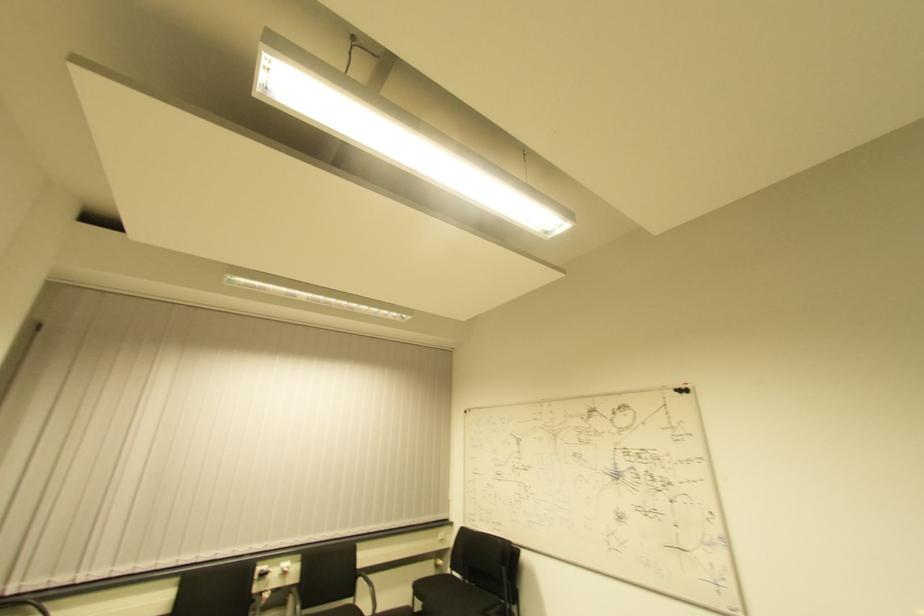
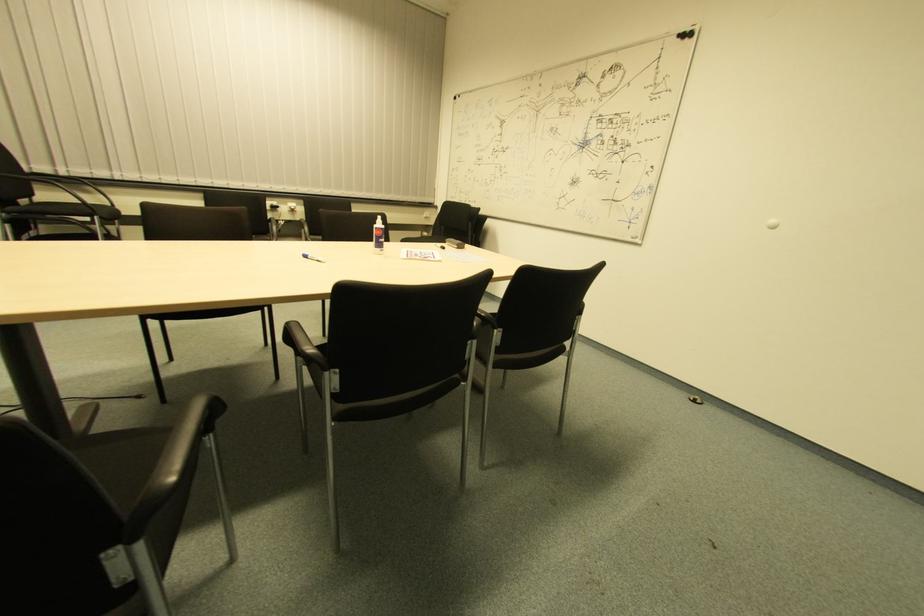
Question: The first image is from the beginning of the video and the second image is from the end. How did the camera likely rotate when shooting the video?

Choices:
 (A) Left
 (B) Right
 (C) Up
 (D) Down

Answer: (D)